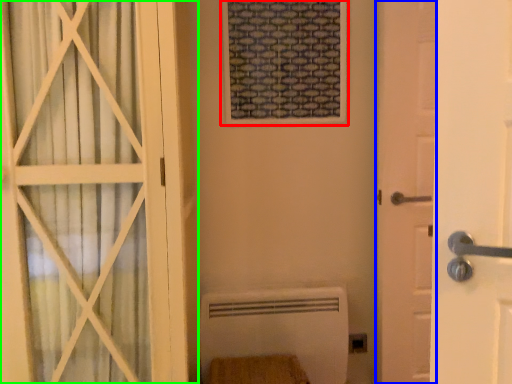
Question: Which object is the farthest from window frame (highlighted by a red box)? Choose among these: door (highlighted by a blue box) or door (highlighted by a green box).

Choices:
 (A) door
 (B) door

Answer: (B)